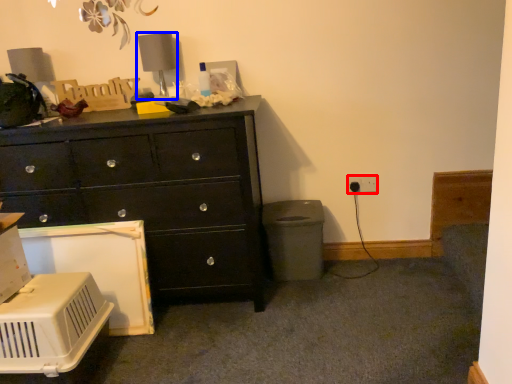
Question: Which object is further to the camera taking this photo, electric outlet (highlighted by a red box) or table lamp (highlighted by a blue box)?

Choices:
 (A) electric outlet
 (B) table lamp

Answer: (A)